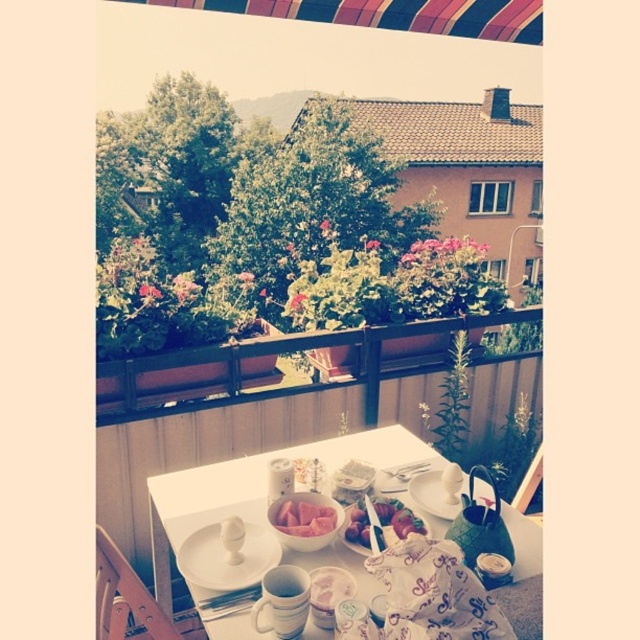
Who is taller, white glossy table at center or striped fabric canopy at upper center?

With more height is white glossy table at center.

Is point (166, 483) in front of point (323, 10)?

Yes, it is.

Locate an element on the screen. This screenshot has width=640, height=640. white glossy table at center is located at coordinates (257, 484).

How far apart are striped fabric canopy at upper center and white glossy plate at center?

striped fabric canopy at upper center and white glossy plate at center are 1.34 meters apart from each other.

Between striped fabric canopy at upper center and white glossy plate at center, which one is positioned lower?

white glossy plate at center is below.

Is point (381, 19) farther from camera compared to point (429, 513)?

That is True.

Image resolution: width=640 pixels, height=640 pixels. I want to click on striped fabric canopy at upper center, so click(x=394, y=13).

Which is behind, point (259, 547) or point (353, 513)?

Point (353, 513)

What do you see at coordinates (227, 556) in the screenshot? I see `white glossy platter at center` at bounding box center [227, 556].

I want to click on white glossy platter at center, so click(227, 556).